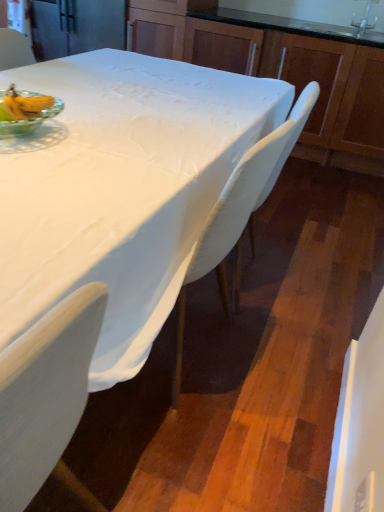
What do you see at coordinates (279, 71) in the screenshot? I see `wooden cabinets at upper center` at bounding box center [279, 71].

This screenshot has height=512, width=384. Find the location of `white fabric-covered table at center`. white fabric-covered table at center is located at coordinates (120, 189).

What do you see at coordinates (120, 189) in the screenshot?
I see `white fabric-covered table at center` at bounding box center [120, 189].

Locate an element on the screen. This screenshot has height=512, width=384. green glass bowl at upper left is located at coordinates (25, 111).

What do you see at coordinates (365, 20) in the screenshot?
I see `satin nickel faucet at upper right` at bounding box center [365, 20].

Locate an element on the screen. white plastic chair at upper left, which is counted as the first chair, starting from the left is located at coordinates (14, 49).

Looking at this image, is white plastic chair at center, which is counted as the second chair, starting from the top, inside or outside of wooden cabinets at upper center?

white plastic chair at center, which is counted as the second chair, starting from the top, is outside wooden cabinets at upper center.

From a real-world perspective, is white plastic chair at center, which is counted as the second chair, starting from the top, located beneath wooden cabinets at upper center?

Yes.

Are white plastic chair at center, which is the first chair in front-to-back order, and wooden cabinets at upper center making contact?

No, white plastic chair at center, which is the first chair in front-to-back order, is not with wooden cabinets at upper center.

I want to click on chair below the green glass bowl at upper left (from the image's perspective), so click(x=240, y=214).

From a real-world perspective, is green glass bowl at upper left beneath white plastic chair at center, the 1th chair from the bottom?

No, from a real-world perspective, green glass bowl at upper left is not beneath white plastic chair at center, the 1th chair from the bottom.

Considering the positions of objects green glass bowl at upper left and white plastic chair at center, which is the first chair in front-to-back order, in the image provided, who is behind, green glass bowl at upper left or white plastic chair at center, which is the first chair in front-to-back order,?

white plastic chair at center, which is the first chair in front-to-back order, is further away from the camera.

Which of these two, green glass bowl at upper left or white plastic chair at center, the 1th chair from the bottom, stands taller?

With more height is white plastic chair at center, the 1th chair from the bottom.

At what (x,y) coordinates should I click in order to perform the action: click on cabinetry located on the right of white plastic chair at center, which is the second chair from left to right. Please return your answer as a coordinate pair (x, y). Image resolution: width=384 pixels, height=512 pixels. Looking at the image, I should click on (279, 71).

How many degrees apart are the facing directions of wooden cabinets at upper center and white plastic chair at center, the 1th chair from the bottom?

81.8 degrees separate the facing orientations of wooden cabinets at upper center and white plastic chair at center, the 1th chair from the bottom.

Is wooden cabinets at upper center directly adjacent to white plastic chair at center, which is counted as the second chair, starting from the top?

No, wooden cabinets at upper center is not touching white plastic chair at center, which is counted as the second chair, starting from the top.

Is wooden cabinets at upper center oriented away from white plastic chair at center, which is the first chair in front-to-back order?

No.

Locate an element on the screen. The image size is (384, 512). cabinetry behind the white fabric-covered table at center is located at coordinates (279, 71).

Considering the positions of points (378, 104) and (161, 138), is point (378, 104) farther from camera compared to point (161, 138)?

Yes, it is.

Is wooden cabinets at upper center to the right of white fabric-covered table at center from the viewer's perspective?

Yes, wooden cabinets at upper center is to the right of white fabric-covered table at center.

In the scene shown: Is wooden cabinets at upper center surrounding white fabric-covered table at center?

No, white fabric-covered table at center is not a part of wooden cabinets at upper center.

From the image's perspective, is white fabric-covered table at center below white plastic chair at center, which is the first chair in front-to-back order?

Yes, from the image's perspective, white fabric-covered table at center is beneath white plastic chair at center, which is the first chair in front-to-back order.

Is white fabric-covered table at center in front of white plastic chair at center, which is the 2th chair from back to front?

Yes, the depth of white fabric-covered table at center is less than that of white plastic chair at center, which is the 2th chair from back to front.

Considering the points (196, 221) and (250, 161), which point is in front, point (196, 221) or point (250, 161)?

The point (250, 161) is closer.

Is white plastic chair at upper left, the 1th chair when ordered from top to bottom, with satin nickel faucet at upper right?

No, white plastic chair at upper left, the 1th chair when ordered from top to bottom, is not next to satin nickel faucet at upper right.

Is white plastic chair at upper left, arranged as the 2th chair when ordered from the bottom, outside of satin nickel faucet at upper right?

Yes, white plastic chair at upper left, arranged as the 2th chair when ordered from the bottom, is outside of satin nickel faucet at upper right.

At what (x,y) coordinates should I click in order to perform the action: click on faucet located in front of the white plastic chair at upper left, the 2th chair from the front. Please return your answer as a coordinate pair (x, y). Image resolution: width=384 pixels, height=512 pixels. Looking at the image, I should click on (365, 20).

Could you measure the distance between white plastic chair at upper left, the 1th chair viewed from the back, and satin nickel faucet at upper right?

white plastic chair at upper left, the 1th chair viewed from the back, and satin nickel faucet at upper right are 7.98 feet apart.

Looking at this image, is white fabric-covered table at center positioned with its back to satin nickel faucet at upper right?

No, white fabric-covered table at center is not facing the opposite direction of satin nickel faucet at upper right.

Are white fabric-covered table at center and satin nickel faucet at upper right beside each other?

They are not placed beside each other.

From the image's perspective, is white fabric-covered table at center above or below satin nickel faucet at upper right?

Clearly, from the image's perspective, white fabric-covered table at center is below satin nickel faucet at upper right.

Image resolution: width=384 pixels, height=512 pixels. Identify the location of cabinetry behind the white plastic chair at center, which is the second chair from left to right. (279, 71).

In order to click on chair that is the 2nd object directly below the green glass bowl at upper left (from a real-world perspective) in this screenshot , I will do `click(240, 214)`.

When comparing their distances from satin nickel faucet at upper right, does wooden cabinets at upper center or white fabric-covered table at center seem further?

white fabric-covered table at center is further to satin nickel faucet at upper right.

From the image, which object appears to be nearer to white plastic chair at upper left, which is counted as the first chair, starting from the left, green glass bowl at upper left or wooden cabinets at upper center?

green glass bowl at upper left is closer to white plastic chair at upper left, which is counted as the first chair, starting from the left.

From the image, which object appears to be nearer to white plastic chair at center, which is the second chair from left to right, white fabric-covered table at center or satin nickel faucet at upper right?

white fabric-covered table at center is positioned closer to the anchor white plastic chair at center, which is the second chair from left to right.

Looking at the image, which one is located further to white fabric-covered table at center, wooden cabinets at upper center or white plastic chair at upper left, the 1th chair when ordered from top to bottom?

Based on the image, wooden cabinets at upper center appears to be further to white fabric-covered table at center.

Looking at the image, which one is located closer to white plastic chair at upper left, the 2th chair from the front, green glass bowl at upper left or white plastic chair at center, which is the first chair in front-to-back order?

green glass bowl at upper left is positioned closer to the anchor white plastic chair at upper left, the 2th chair from the front.

Which object lies nearer to the anchor point satin nickel faucet at upper right, white plastic chair at center, which is the second chair from left to right, or white fabric-covered table at center?

Among the two, white plastic chair at center, which is the second chair from left to right, is located nearer to satin nickel faucet at upper right.

Looking at the image, which one is located further to white plastic chair at upper left, the second chair from the right, satin nickel faucet at upper right or white plastic chair at center, which is the second chair from left to right?

The object further to white plastic chair at upper left, the second chair from the right, is satin nickel faucet at upper right.

Looking at the image, which one is located further to white fabric-covered table at center, wooden cabinets at upper center or satin nickel faucet at upper right?

The object further to white fabric-covered table at center is satin nickel faucet at upper right.

This screenshot has width=384, height=512. Identify the location of fruit dish between white plastic chair at upper left, the 1th chair when ordered from top to bottom, and satin nickel faucet at upper right from left to right. (25, 111).

Find the location of a particular element. The width and height of the screenshot is (384, 512). chair located between white fabric-covered table at center and white plastic chair at upper left, the second chair from the right, in the depth direction is located at coordinates (240, 214).

The image size is (384, 512). In order to click on chair positioned between green glass bowl at upper left and satin nickel faucet at upper right from near to far in this screenshot , I will do `click(240, 214)`.

Locate an element on the screen. cabinetry between green glass bowl at upper left and satin nickel faucet at upper right in the front-back direction is located at coordinates (279, 71).